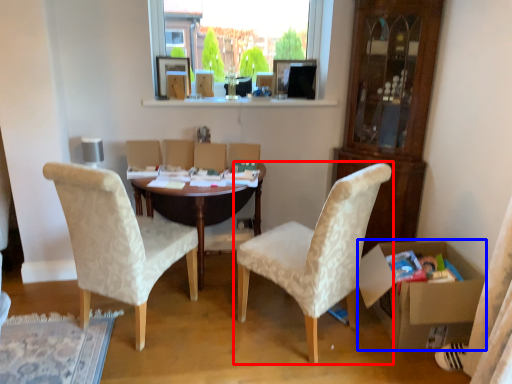
Question: Among these objects, which one is nearest to the camera, chair (highlighted by a red box) or box (highlighted by a blue box)?

Choices:
 (A) chair
 (B) box

Answer: (A)